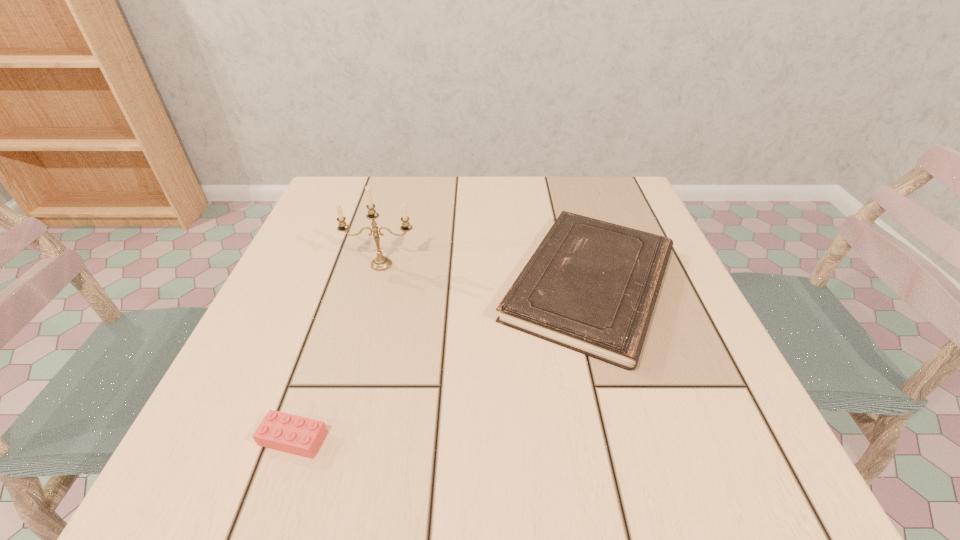
Where is `Lego present at the left edge`? The height and width of the screenshot is (540, 960). Lego present at the left edge is located at coordinates (293, 434).

This screenshot has height=540, width=960. Find the location of `object at the right edge`. object at the right edge is located at coordinates (591, 286).

Locate an element on the screen. The image size is (960, 540). object that is at the near left corner is located at coordinates (293, 434).

Locate an element on the screen. Image resolution: width=960 pixels, height=540 pixels. object that is positioned at the far right corner is located at coordinates (591, 286).

The height and width of the screenshot is (540, 960). In the image, there is a desktop. Identify the location of vacant space at the far edge. (x=397, y=186).

Where is `vacant space at the near edge of the desktop`? vacant space at the near edge of the desktop is located at coordinates (472, 458).

Locate an element on the screen. This screenshot has width=960, height=540. free space at the left edge of the desktop is located at coordinates (337, 329).

You are a GUI agent. You are given a task and a screenshot of the screen. Output one action in this format:
    pyautogui.click(x=<x>, y=<y>)
    Task: Click on the vacant space at the right edge
    The image size is (960, 540).
    Given the screenshot: What is the action you would take?
    pyautogui.click(x=689, y=288)

This screenshot has width=960, height=540. In order to click on vacant space at the far left corner of the desktop in this screenshot , I will do `click(309, 226)`.

Locate an element on the screen. The height and width of the screenshot is (540, 960). vacant region at the far right corner of the desktop is located at coordinates (589, 186).